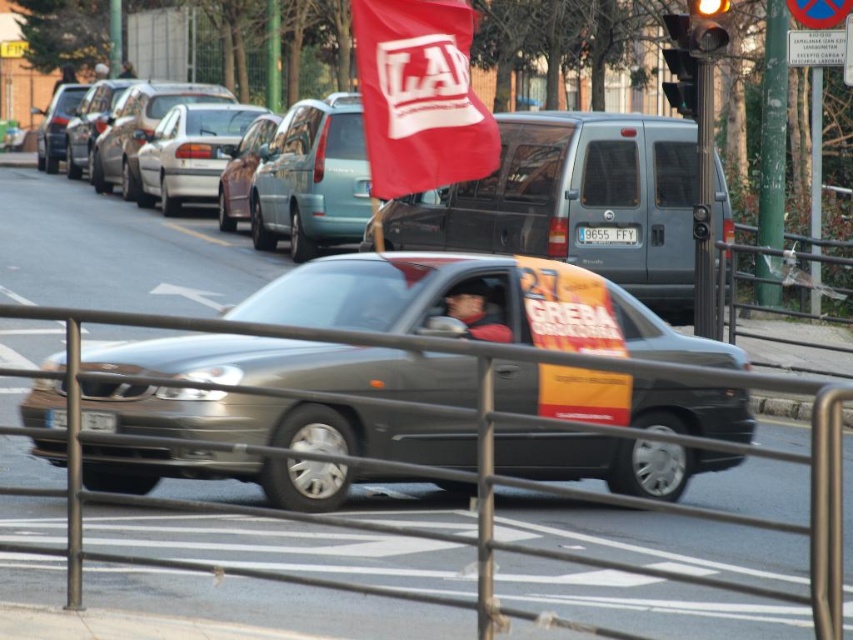
Question: Based on their relative distances, which object is farther from the matte black shirt at center?

Choices:
 (A) white plastic license plate at center
 (B) silver metallic sedan at center
 (C) red fabric flag at upper center
 (D) dark gray fabric jacket at center

Answer: (D)

Question: Does metallic gray rail at center appear under dark gray car at center?

Choices:
 (A) no
 (B) yes

Answer: (B)

Question: Is metallic yellow traffic light at upper center above dark gray car at center?

Choices:
 (A) yes
 (B) no

Answer: (B)

Question: Which of these objects is positioned closest to the metallic yellow traffic light at upper center?

Choices:
 (A) white plastic license plate at center
 (B) silver metallic sedan at center
 (C) matte black shirt at center

Answer: (A)

Question: Is metallic gray rail at center bigger than black plastic license plate at center?

Choices:
 (A) no
 (B) yes

Answer: (B)

Question: Which point appears farthest from the camera in this image?

Choices:
 (A) (309, 337)
 (B) (106, 72)
 (C) (123, 77)
 (D) (105, 413)

Answer: (B)